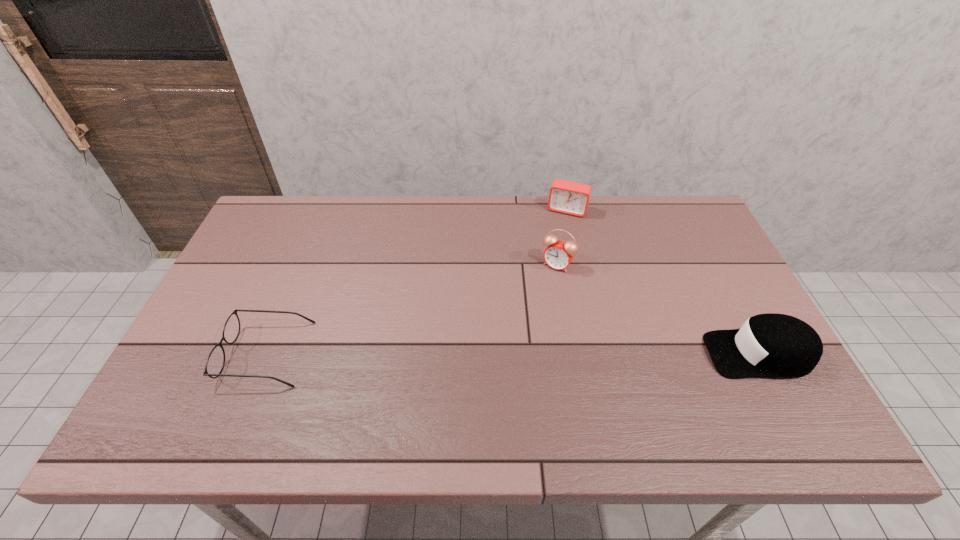
Locate an element on the screen. This screenshot has width=960, height=540. cap that is at the near edge is located at coordinates (777, 345).

Locate an element on the screen. object positioned at the left edge is located at coordinates (215, 363).

The width and height of the screenshot is (960, 540). What are the coordinates of `object located in the right edge section of the desktop` in the screenshot? It's located at (777, 345).

Identify the location of object positioned at the near left corner. This screenshot has height=540, width=960. click(215, 363).

Image resolution: width=960 pixels, height=540 pixels. Identify the location of object located at the near right corner. (777, 345).

In order to click on vacant space at the far edge of the desktop in this screenshot , I will do `click(522, 226)`.

Image resolution: width=960 pixels, height=540 pixels. In order to click on free space at the near edge of the desktop in this screenshot , I will do `click(531, 399)`.

Locate an element on the screen. The width and height of the screenshot is (960, 540). free space at the left edge of the desktop is located at coordinates (267, 265).

Identify the location of free space at the far left corner. (269, 235).

Where is `vacant space that's between the spectacles and the third nearest object`? vacant space that's between the spectacles and the third nearest object is located at coordinates (412, 309).